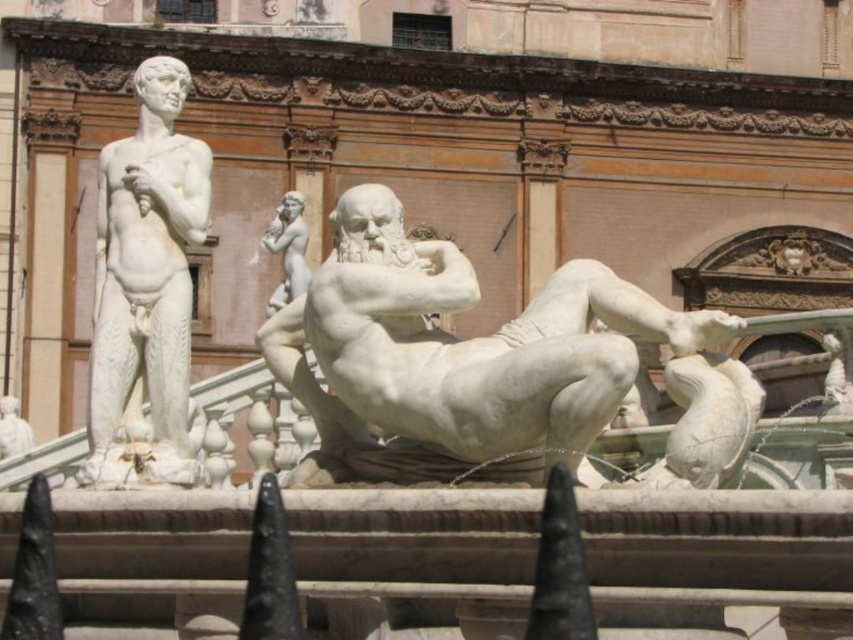
Image resolution: width=853 pixels, height=640 pixels. Describe the element at coordinates (456, 356) in the screenshot. I see `white marble reclining figure at center` at that location.

Which is in front, point (614, 362) or point (279, 298)?

Positioned in front is point (614, 362).

Identify the location of white marble reclining figure at center. (456, 356).

This screenshot has height=640, width=853. Describe the element at coordinates (144, 289) in the screenshot. I see `white marble statue at left` at that location.

Which of these two, white marble statue at left or white marble statue at center, stands taller?

With more height is white marble statue at center.

At what (x,y) coordinates should I click in order to perform the action: click on white marble statue at left. Please return your answer as a coordinate pair (x, y). Image resolution: width=853 pixels, height=640 pixels. Looking at the image, I should click on pyautogui.click(x=144, y=289).

Locate an element on the screen. white marble statue at left is located at coordinates (144, 289).

How much distance is there between white marble reclining figure at center and white marble statue at left?

They are 3.37 meters apart.

Is white marble reclining figure at center shorter than white marble statue at left?

No, white marble reclining figure at center is not shorter than white marble statue at left.

Is point (418, 416) behind point (202, 198)?

No, it is not.

At what (x,y) coordinates should I click in order to perform the action: click on white marble reclining figure at center. Please return your answer as a coordinate pair (x, y). The width and height of the screenshot is (853, 640). Looking at the image, I should click on (456, 356).